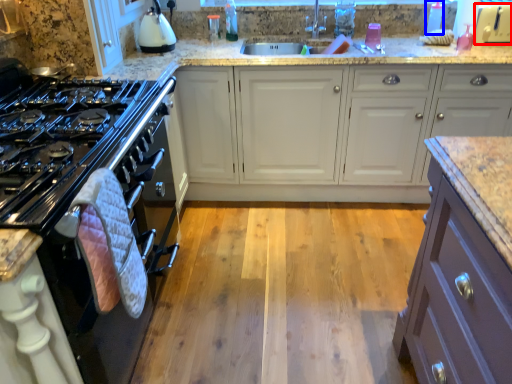
Question: Which of the following is the farthest to the observer, appliance (highlighted by a red box) or bottle (highlighted by a blue box)?

Choices:
 (A) appliance
 (B) bottle

Answer: (B)